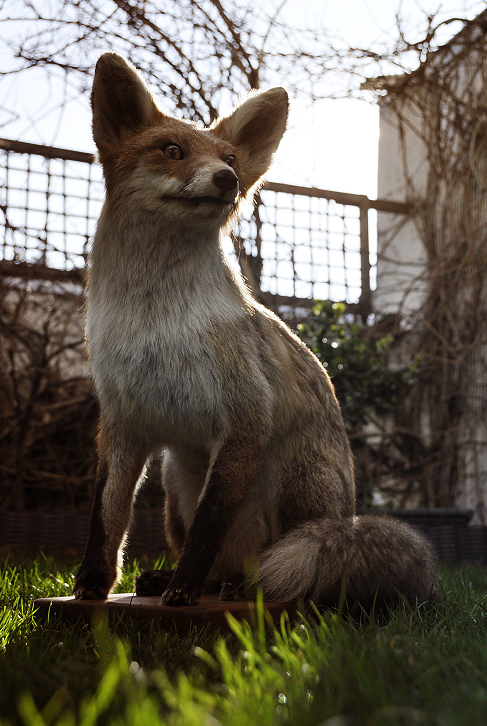
At what (x,y) coordinates should I click in order to perform the action: click on wooden base. Please return your answer as a coordinate pair (x, y). The width and height of the screenshot is (487, 726). Looking at the image, I should click on (149, 611).